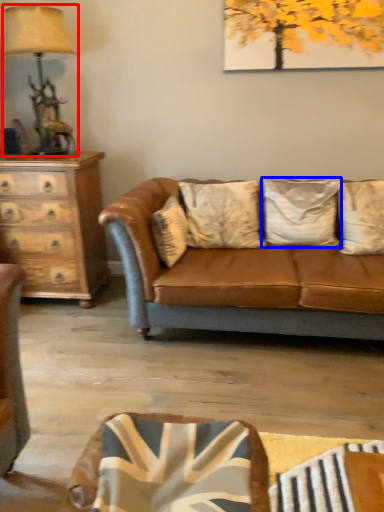
Question: Among these objects, which one is farthest to the camera, table lamp (highlighted by a red box) or pillow (highlighted by a blue box)?

Choices:
 (A) table lamp
 (B) pillow

Answer: (B)